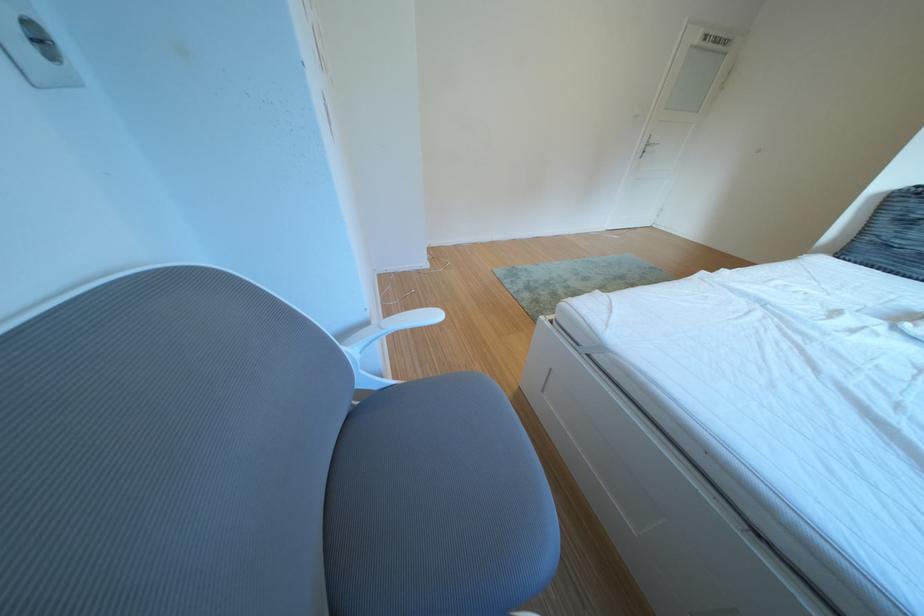
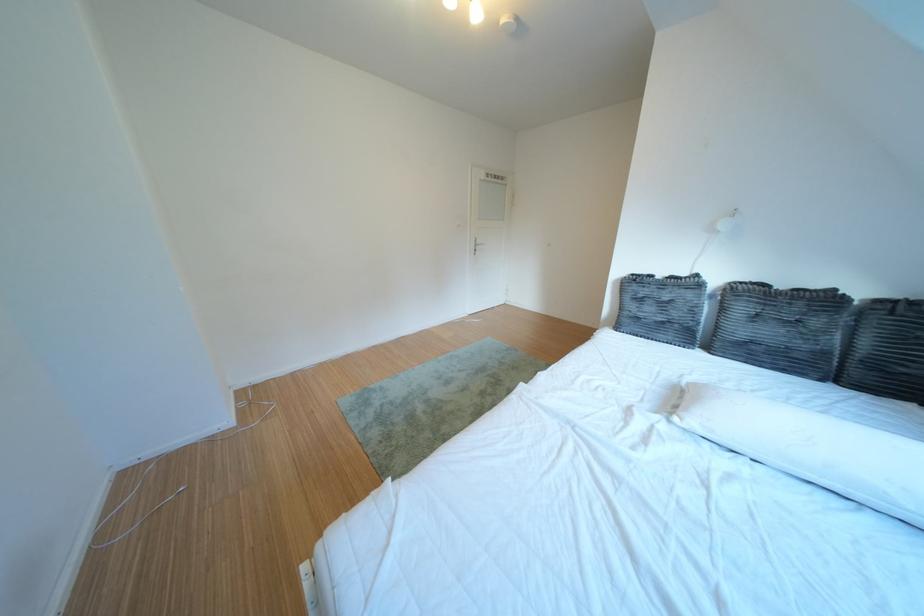
The point at (881, 244) is marked in the first image. Where is the corresponding point in the second image?

(639, 318)